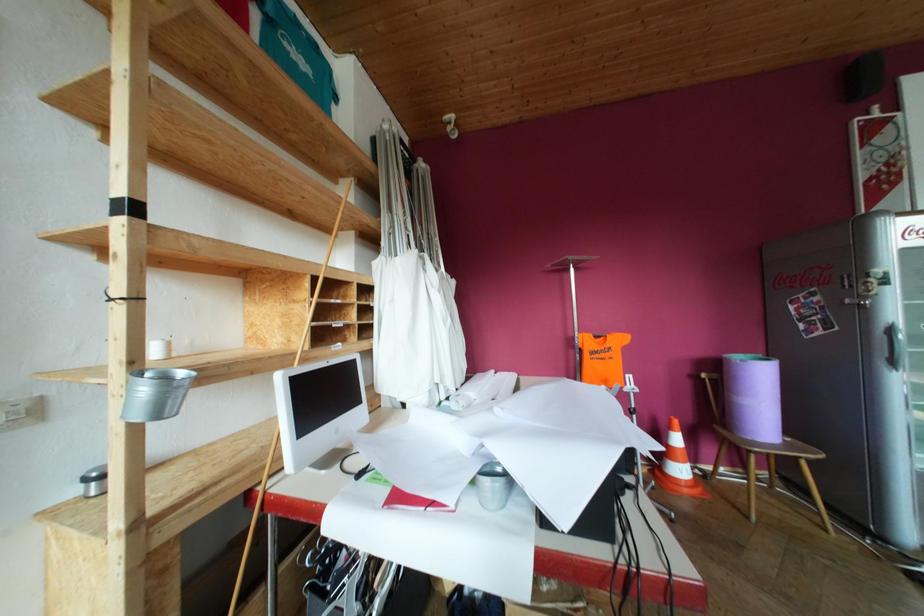
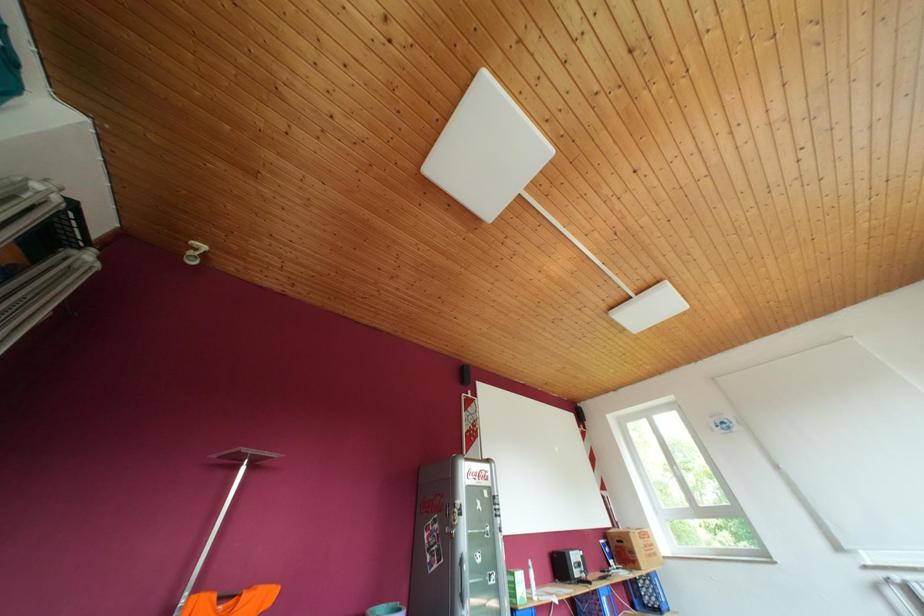
Based on the continuous images, in which direction is the camera rotating?

The camera rotated toward right-up.